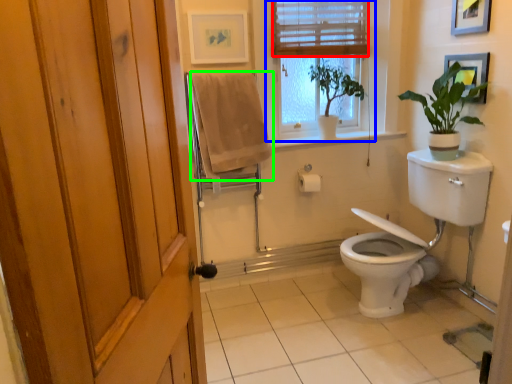
Question: Considering the real-world distances, which object is farthest from blind (highlighted by a red box)? window (highlighted by a blue box) or bath towel (highlighted by a green box)?

Choices:
 (A) window
 (B) bath towel

Answer: (B)